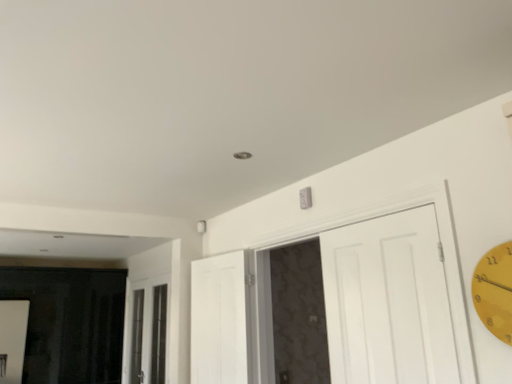
Question: Is white wood door at center, which ranks as the 1th door in left-to-right order, facing away from white matte door at upper center, the 1th door viewed from the right?

Choices:
 (A) no
 (B) yes

Answer: (A)

Question: From a real-world perspective, is white wood door at center, which ranks as the 1th door in left-to-right order, positioned under white matte door at upper center, the 2th door from the left, based on gravity?

Choices:
 (A) yes
 (B) no

Answer: (A)

Question: Does white wood door at center, which ranks as the 1th door in left-to-right order, have a smaller size compared to white matte door at upper center, the 1th door viewed from the right?

Choices:
 (A) yes
 (B) no

Answer: (A)

Question: Does white wood door at center, the 2th door positioned from the right, have a greater width compared to white matte door at upper center, the 2th door from the left?

Choices:
 (A) yes
 (B) no

Answer: (B)

Question: Is white wood door at center, the 2th door positioned from the right, further to the viewer compared to white matte door at upper center, the 2th door from the left?

Choices:
 (A) no
 (B) yes

Answer: (B)

Question: From a real-world perspective, relative to yellow matte clock at right, is white matte door at upper center, the 1th door viewed from the right, vertically above or below?

Choices:
 (A) above
 (B) below

Answer: (B)

Question: Is white matte door at upper center, the 1th door viewed from the right, taller or shorter than yellow matte clock at right?

Choices:
 (A) tall
 (B) short

Answer: (A)

Question: Is point (390, 352) closer or farther from the camera than point (485, 291)?

Choices:
 (A) closer
 (B) farther

Answer: (B)

Question: Choose the correct answer: Is white matte door at upper center, the 1th door viewed from the right, inside yellow matte clock at right or outside it?

Choices:
 (A) inside
 (B) outside

Answer: (B)

Question: Considering the positions of white wood door at center, the 2th door positioned from the right, and white matte door at upper center, the 2th door from the left, in the image, is white wood door at center, the 2th door positioned from the right, taller or shorter than white matte door at upper center, the 2th door from the left,?

Choices:
 (A) tall
 (B) short

Answer: (B)

Question: In the image, is white wood door at center, which ranks as the 1th door in left-to-right order, positioned in front of or behind white matte door at upper center, the 1th door viewed from the right?

Choices:
 (A) front
 (B) behind

Answer: (B)

Question: From a real-world perspective, is white wood door at center, which ranks as the 1th door in left-to-right order, positioned above or below white matte door at upper center, the 2th door from the left?

Choices:
 (A) above
 (B) below

Answer: (B)

Question: In terms of width, does white wood door at center, the 2th door positioned from the right, look wider or thinner when compared to white matte door at upper center, the 1th door viewed from the right?

Choices:
 (A) wide
 (B) thin

Answer: (B)

Question: From a real-world perspective, is clear glass window at center above or below white matte door at upper center, the 1th door viewed from the right?

Choices:
 (A) above
 (B) below

Answer: (B)

Question: Is clear glass window at center taller or shorter than white matte door at upper center, the 1th door viewed from the right?

Choices:
 (A) tall
 (B) short

Answer: (A)